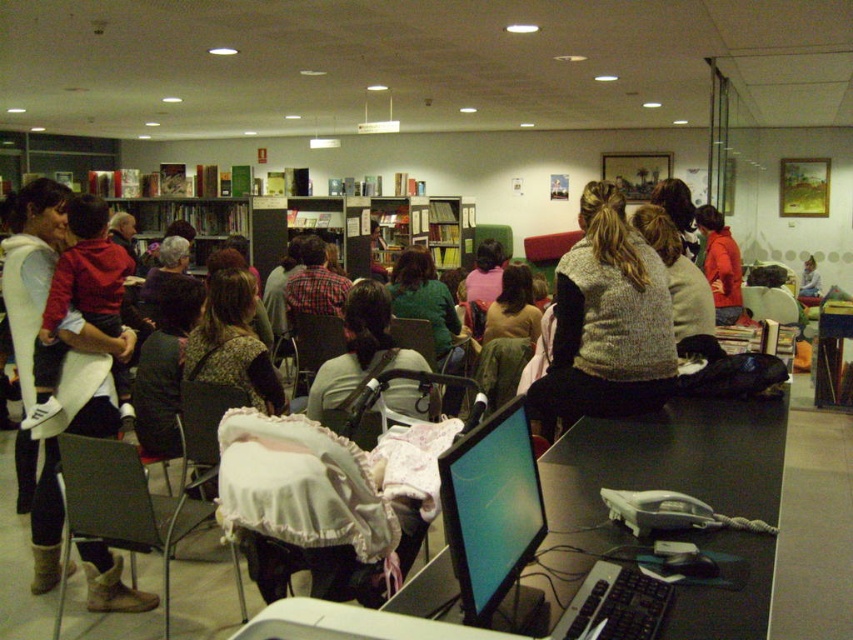
Does white fleece jacket at left have a lesser height compared to green sweater at center?

No.

Consider the image. Between white fleece jacket at left and green sweater at center, which one has less height?

green sweater at center is shorter.

This screenshot has width=853, height=640. What do you see at coordinates (73, 433) in the screenshot?
I see `white fleece jacket at left` at bounding box center [73, 433].

In order to click on white fleece jacket at left in this screenshot , I will do `click(73, 433)`.

Is knitted gray sweater at center thinner than white fleece jacket at left?

Correct, knitted gray sweater at center's width is less than white fleece jacket at left's.

Does point (566, 349) lie in front of point (47, 572)?

Yes, point (566, 349) is closer to viewer.

The image size is (853, 640). What are the coordinates of `knitted gray sweater at center` in the screenshot? It's located at (606, 323).

Between wooden bookshelf at center and brown textured sweater at center, which one has less height?

With less height is brown textured sweater at center.

Where is `wooden bookshelf at center`? This screenshot has height=640, width=853. wooden bookshelf at center is located at coordinates (184, 221).